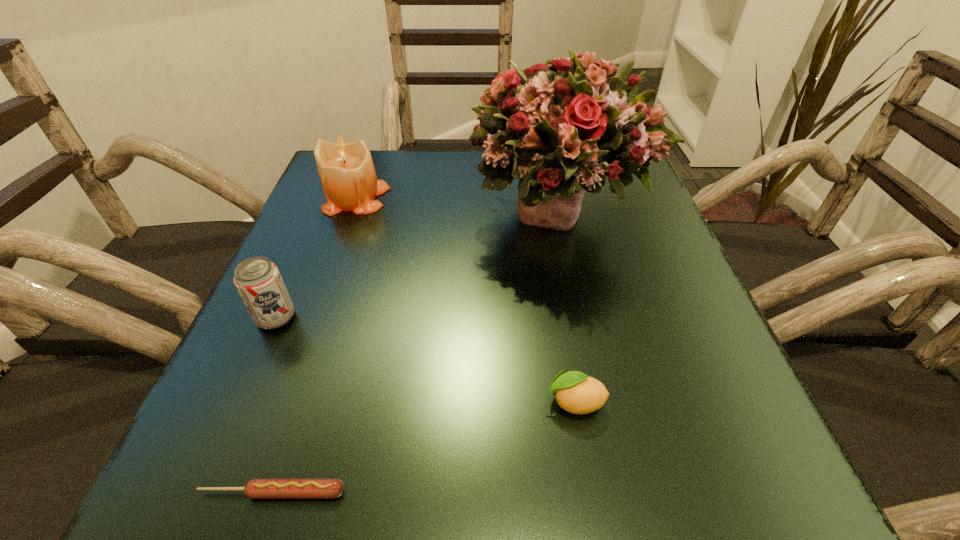
Find the location of a particular element. This screenshot has width=960, height=540. vacant space at the near right corner of the desktop is located at coordinates pyautogui.click(x=726, y=441).

Identify the location of empty space that is in between the shortest object and the fourth tallest object. This screenshot has height=540, width=960. (423, 447).

The image size is (960, 540). Identify the location of free spot between the beer can and the candle. (317, 258).

The width and height of the screenshot is (960, 540). In order to click on free point between the tallest object and the lemon in this screenshot , I will do `click(566, 307)`.

This screenshot has width=960, height=540. I want to click on free space between the third nearest object and the bouquet, so click(x=418, y=266).

You are a GUI agent. You are given a task and a screenshot of the screen. Output one action in this format:
    pyautogui.click(x=<x>, y=<y>)
    Task: Click on the free space between the lemon and the candle
    This screenshot has height=540, width=960.
    Given the screenshot: What is the action you would take?
    pyautogui.click(x=466, y=300)

Find the location of `vacant region between the second tallest object and the bouquet`. vacant region between the second tallest object and the bouquet is located at coordinates (458, 205).

This screenshot has width=960, height=540. Identify the location of free space between the candle and the lemon. (466, 300).

In order to click on free space that is in between the candle and the third shortest object in this screenshot , I will do `click(317, 258)`.

You are a GUI agent. You are given a task and a screenshot of the screen. Output one action in this format:
    pyautogui.click(x=<x>, y=<y>)
    Task: Click on the vacant space that's between the second tallest object and the lemon
    This screenshot has width=960, height=540.
    Given the screenshot: What is the action you would take?
    pyautogui.click(x=466, y=300)